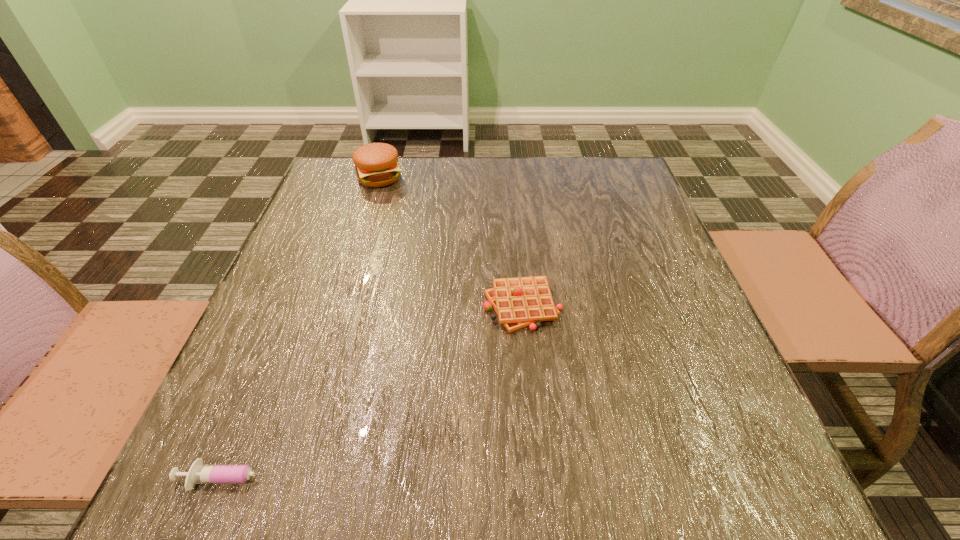
Identify the location of free spot between the farthest object and the waffle. (451, 241).

Where is `free space that is in between the farthest object and the rightmost object`? Image resolution: width=960 pixels, height=540 pixels. free space that is in between the farthest object and the rightmost object is located at coordinates tap(451, 241).

Where is `the closest object to the syringe`? The height and width of the screenshot is (540, 960). the closest object to the syringe is located at coordinates (519, 302).

Where is `object that can be found as the second closest to the farthest object`? object that can be found as the second closest to the farthest object is located at coordinates (198, 473).

What are the coordinates of `free location that satisfies the following two spatial constraints: 1. on the back side of the nearest object; 2. on the left side of the second farthest object` in the screenshot? It's located at (305, 305).

The image size is (960, 540). Identify the location of vacant space that satisfies the following two spatial constraints: 1. on the back side of the syringe; 2. on the right side of the farthest object. (354, 178).

Where is `free space that satisfies the following two spatial constraints: 1. on the back side of the second nearest object; 2. on the left side of the syringe`? This screenshot has height=540, width=960. free space that satisfies the following two spatial constraints: 1. on the back side of the second nearest object; 2. on the left side of the syringe is located at coordinates (305, 305).

This screenshot has width=960, height=540. I want to click on vacant space that satisfies the following two spatial constraints: 1. on the back side of the second shortest object; 2. on the right side of the shortest object, so click(x=305, y=305).